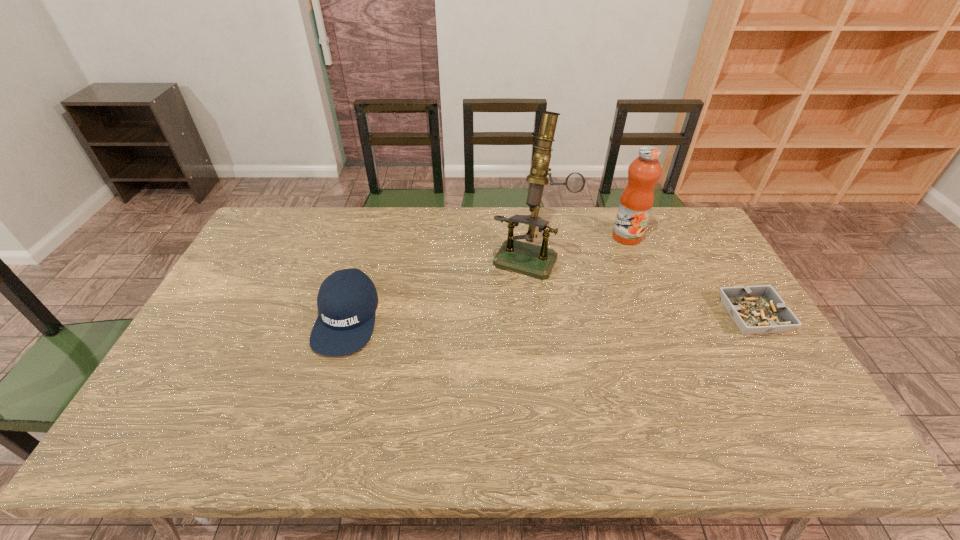
Identify the location of baseball cap. (347, 300).

Locate an element on the screen. the leftmost object is located at coordinates pos(347,300).

Identify the location of ashtray. (759, 309).

This screenshot has height=540, width=960. I want to click on the rightmost object, so click(x=759, y=309).

Locate an element on the screen. The width and height of the screenshot is (960, 540). the third object from left to right is located at coordinates (637, 199).

Where is `the second tallest object`? the second tallest object is located at coordinates (637, 199).

I want to click on microscope, so click(x=538, y=261).

Locate an element on the screen. the tallest object is located at coordinates (538, 261).

The image size is (960, 540). In order to click on free space located 0.150m on the front-facing side of the baseball cap in this screenshot , I will do `click(320, 409)`.

Find the location of a particular element. free region located 0.400m on the left of the shortest object is located at coordinates (586, 316).